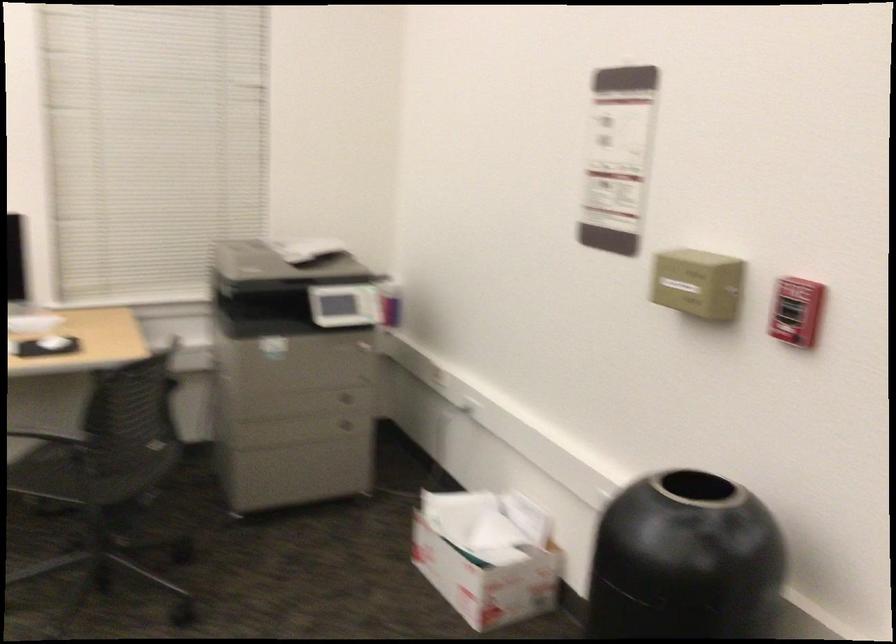
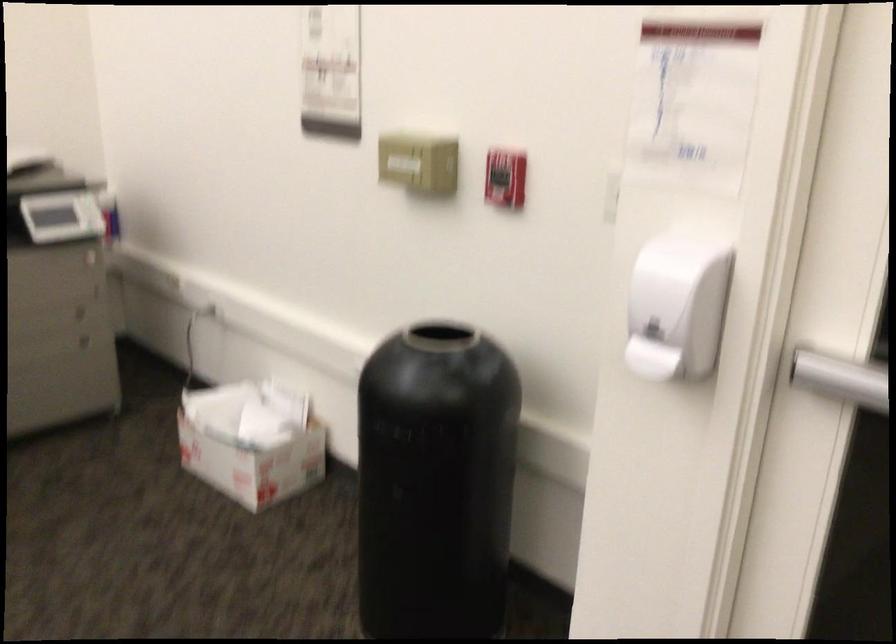
Question: How did the camera likely rotate?

Choices:
 (A) Left
 (B) Right
 (C) Up
 (D) Down

Answer: (B)